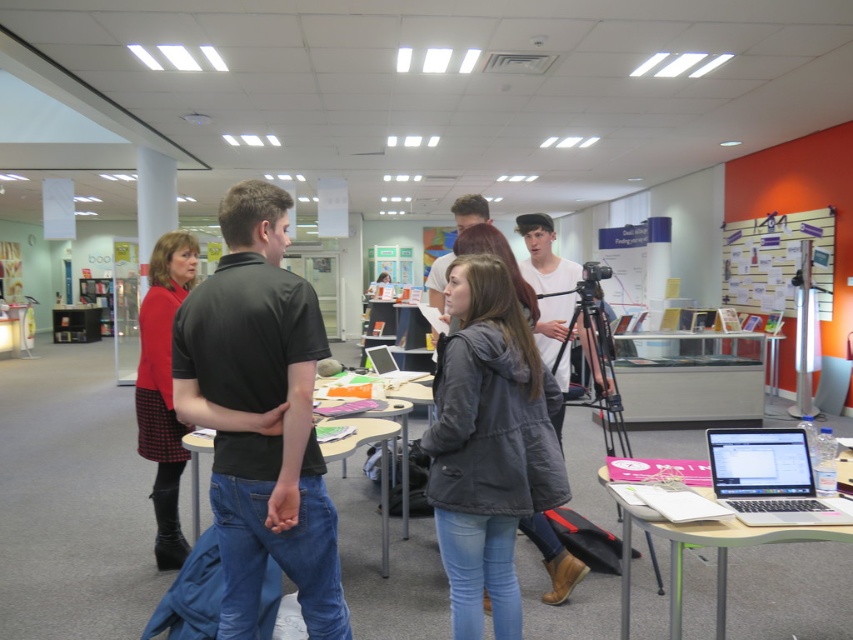
Does dark gray jacket at center have a greater height compared to silver metallic laptop at lower right?

Yes, dark gray jacket at center is taller than silver metallic laptop at lower right.

Is dark gray jacket at center to the left of silver metallic laptop at lower right from the viewer's perspective?

Indeed, dark gray jacket at center is positioned on the left side of silver metallic laptop at lower right.

This screenshot has width=853, height=640. What do you see at coordinates (488, 444) in the screenshot?
I see `dark gray jacket at center` at bounding box center [488, 444].

Find the location of a particular element. dark gray jacket at center is located at coordinates (488, 444).

Is black matte shirt at center wider than dark gray jacket at center?

Yes, black matte shirt at center is wider than dark gray jacket at center.

Can you confirm if black matte shirt at center is bigger than dark gray jacket at center?

Yes.

Does point (288, 564) come closer to viewer compared to point (538, 465)?

Yes, it is in front of point (538, 465).

I want to click on black matte shirt at center, so [x=260, y=416].

The height and width of the screenshot is (640, 853). Find the location of `dark gray jacket at center`. dark gray jacket at center is located at coordinates (488, 444).

Does dark gray jacket at center have a greater width compared to silver metallic tablet at center?

Yes, dark gray jacket at center is wider than silver metallic tablet at center.

Is point (463, 412) behind point (381, 362)?

No, (463, 412) is in front of (381, 362).

You are a GUI agent. You are given a task and a screenshot of the screen. Output one action in this format:
    pyautogui.click(x=<x>, y=<y>)
    Task: Click on the dark gray jacket at center
    
    Given the screenshot: What is the action you would take?
    (x=488, y=444)